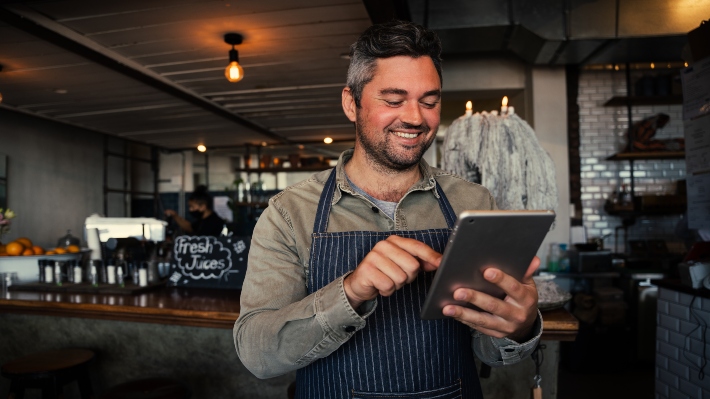
Find the location of `shelf`. shelf is located at coordinates (620, 99), (628, 156), (640, 214).